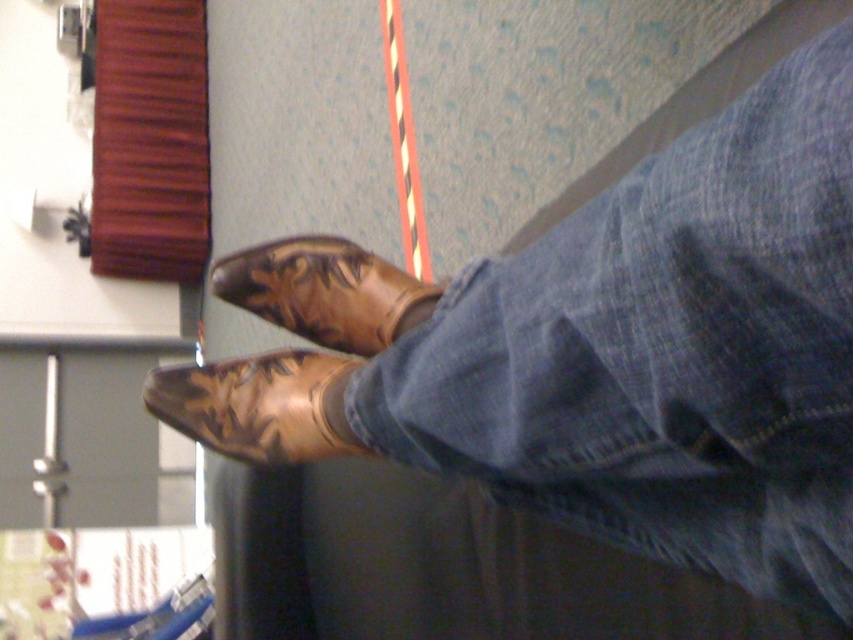
You are standing in the room shown in the image and want to move from point A to point B. Point A is at coordinate point (535, 291) and point B is at coordinate point (384, 348). Which direction should you move to get closer to point B?

To move from point A at coordinate point (535, 291) to point B at coordinate point (384, 348), you should move towards the upper right direction since point B is located in that direction relative to point A.

You are standing in a room with a greenish blue carpet that has a red and white striped line along the edge. You see a shiny brown leather boot at lower center and a brown leather boot at center. Which boot is closer to the striped line on the carpet?

The shiny brown leather boot at lower center is closer to the striped line on the carpet because it is positioned to the left of the brown leather boot at center, and the striped line is along the edge of the carpet near the left side of the image.

You are trying to decide which boot to wear for a casual walk. Both the shiny brown leather boot at lower center and the brown leather boot at center are options. Which one has a wider base?

The shiny brown leather boot at lower center has a larger width than the brown leather boot at center, so it has a wider base.